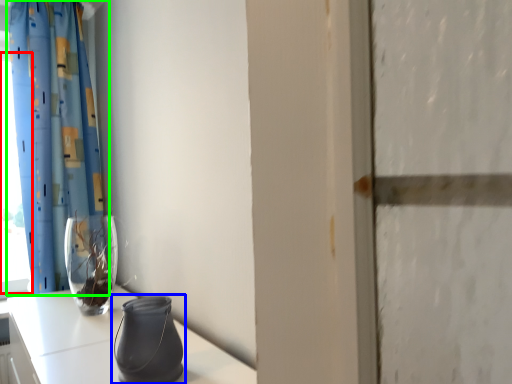
Question: Considering the real-world distances, which object is farthest from window (highlighted by a red box)? vase (highlighted by a blue box) or curtain (highlighted by a green box)?

Choices:
 (A) vase
 (B) curtain

Answer: (A)